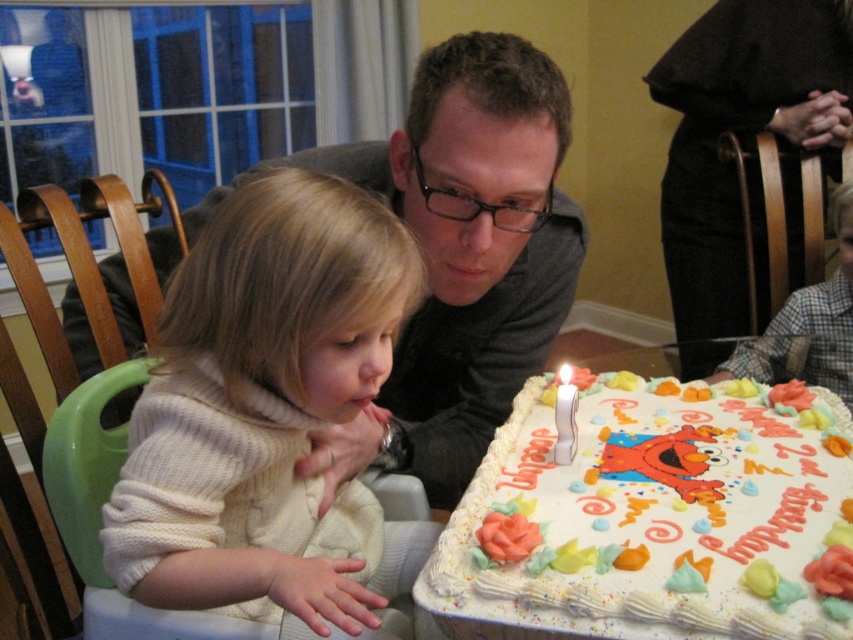
Question: Among these points, which one is farthest from the camera?

Choices:
 (A) (300, 461)
 (B) (567, 428)

Answer: (B)

Question: Estimate the real-world distances between objects in this image. Which object is farther from the matte gray shirt at upper center?

Choices:
 (A) white frosted cake at center
 (B) white wax candle at lower right
 (C) plaid shirt at lower right

Answer: (B)

Question: Can you confirm if matte gray shirt at upper center is positioned below plaid shirt at lower right?

Choices:
 (A) no
 (B) yes

Answer: (A)

Question: In this image, where is white frosted cake at center located relative to plaid shirt at lower right?

Choices:
 (A) right
 (B) left

Answer: (B)

Question: Among these points, which one is nearest to the camera?

Choices:
 (A) (836, 419)
 (B) (250, 499)
 (C) (553, 458)
 (D) (827, 77)

Answer: (B)

Question: Is matte gray shirt at center to the right of white wax candle at lower right from the viewer's perspective?

Choices:
 (A) no
 (B) yes

Answer: (A)